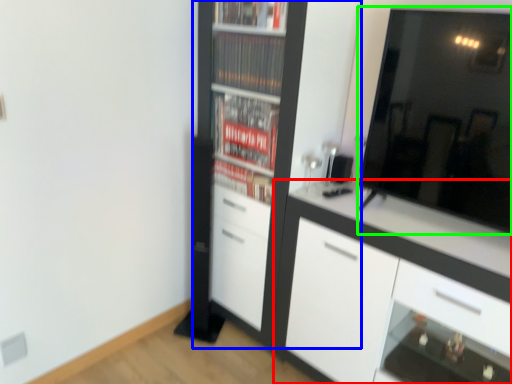
Question: Estimate the real-world distances between objects in this image. Which object is farther from cabinetry (highlighted by a red box), cupboard (highlighted by a blue box) or mirror (highlighted by a green box)?

Choices:
 (A) cupboard
 (B) mirror

Answer: (A)